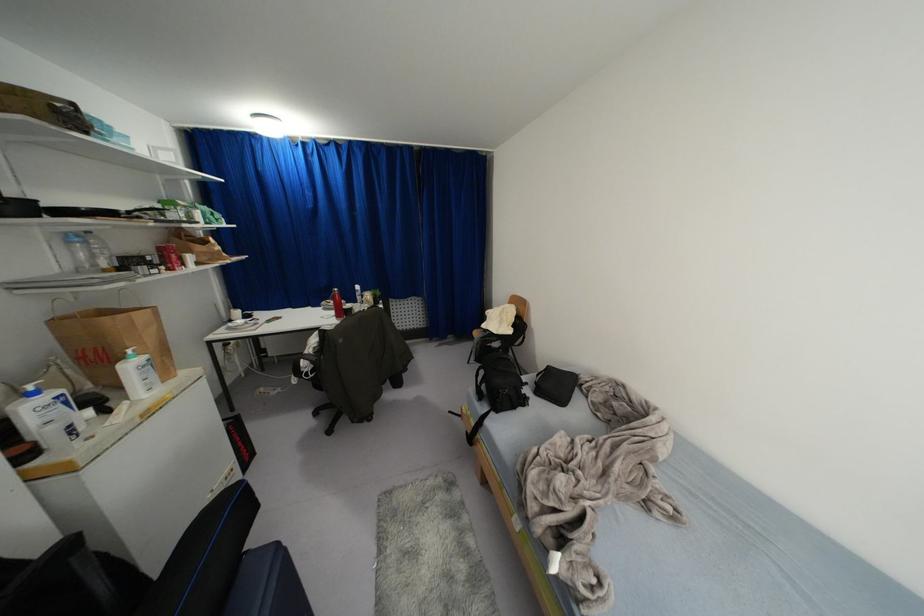
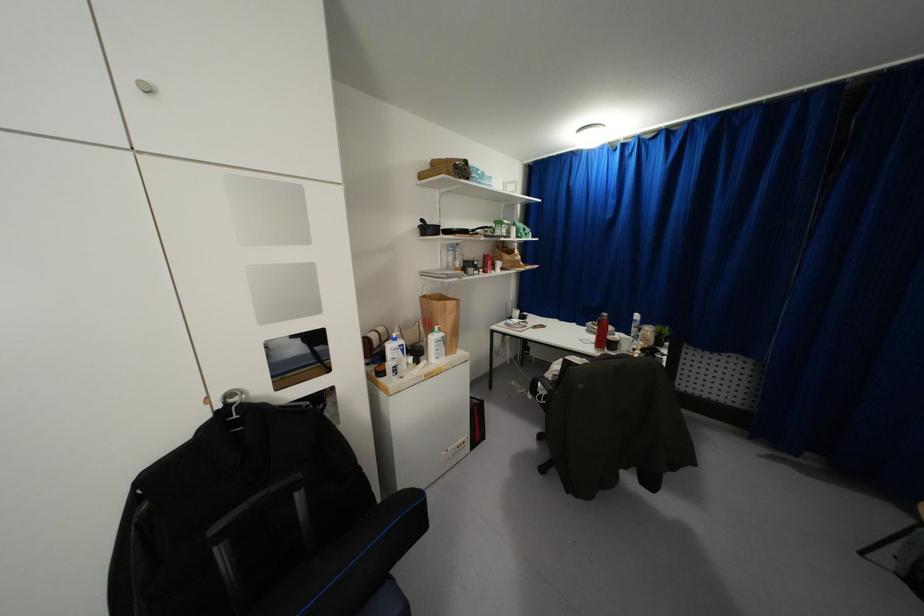
The point at [65,402] is marked in the first image. Where is the corresponding point in the second image?

(402, 350)